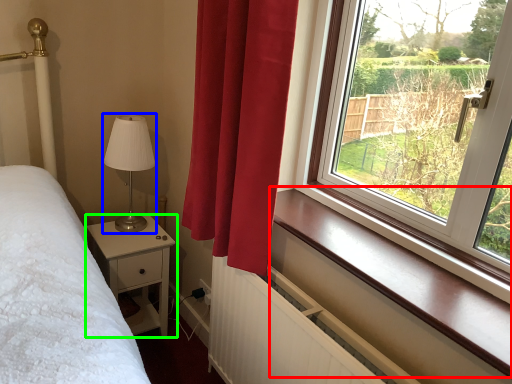
Question: Considering the real-world distances, which object is closest to window sill (highlighted by a red box)? table lamp (highlighted by a blue box) or nightstand (highlighted by a green box).

Choices:
 (A) table lamp
 (B) nightstand

Answer: (B)